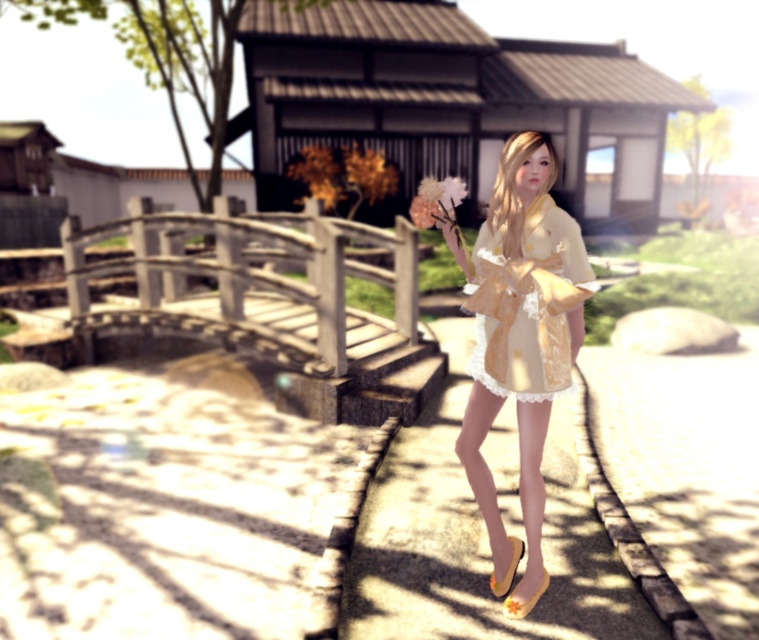
Question: Which object is positioned farthest from the light yellow lace dress at center?

Choices:
 (A) matte yellow kimono at center
 (B) matte pink flower at center

Answer: (B)

Question: Which of the following is the closest to the observer?

Choices:
 (A) (461, 186)
 (B) (380, 280)

Answer: (A)

Question: Estimate the real-world distances between objects in this image. Which object is farther from the wooden bridge at left?

Choices:
 (A) light yellow lace dress at center
 (B) matte yellow kimono at center

Answer: (A)

Question: Is wooden bridge at left thinner than light yellow lace dress at center?

Choices:
 (A) yes
 (B) no

Answer: (B)

Question: Is matte yellow kimono at center positioned behind light yellow lace dress at center?

Choices:
 (A) yes
 (B) no

Answer: (A)

Question: Is wooden bridge at left in front of light yellow lace dress at center?

Choices:
 (A) yes
 (B) no

Answer: (B)